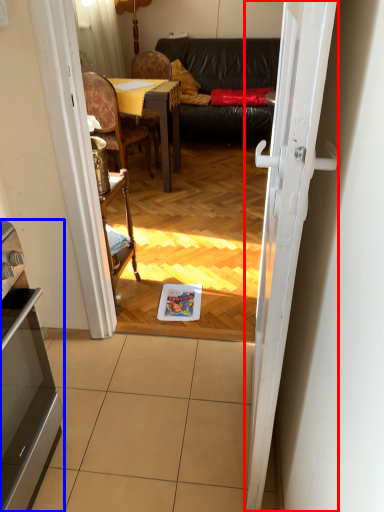
Question: Among these objects, which one is nearest to the camera, door (highlighted by a red box) or appliance (highlighted by a blue box)?

Choices:
 (A) door
 (B) appliance

Answer: (A)